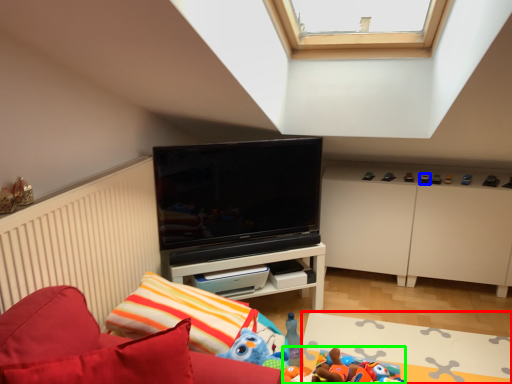
Question: Which is farther away from plain (highlighted by a red box)? toy (highlighted by a blue box) or toy (highlighted by a green box)?

Choices:
 (A) toy
 (B) toy

Answer: (A)